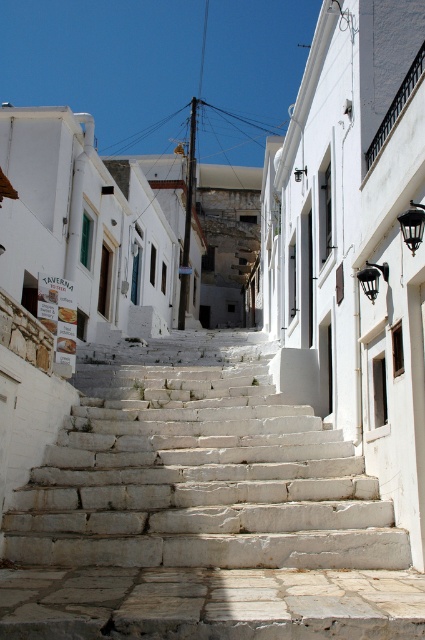
Question: Which object appears farthest from the camera in this image?

Choices:
 (A) white stone stairs at center
 (B) black metal balustrade at upper right

Answer: (B)

Question: Which point is farther to the camera?

Choices:
 (A) white stone stairs at center
 (B) black metal balustrade at upper right

Answer: (B)

Question: Does white stone stairs at center appear over black metal balustrade at upper right?

Choices:
 (A) yes
 (B) no

Answer: (B)

Question: In this image, where is white stone stairs at center located relative to black metal balustrade at upper right?

Choices:
 (A) right
 (B) left

Answer: (B)

Question: Is white stone stairs at center in front of black metal balustrade at upper right?

Choices:
 (A) no
 (B) yes

Answer: (B)